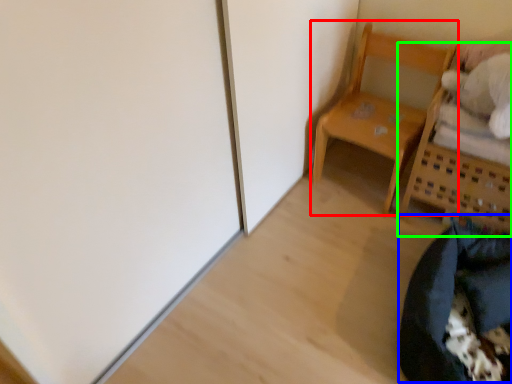
Question: Which is farther away from furniture (highlighted by a red box)? bean bag chair (highlighted by a blue box) or furniture (highlighted by a green box)?

Choices:
 (A) bean bag chair
 (B) furniture

Answer: (A)